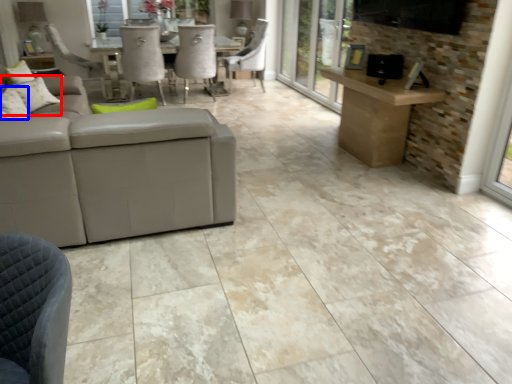
Question: Among these objects, which one is farthest to the camera, pillow (highlighted by a red box) or pillow (highlighted by a blue box)?

Choices:
 (A) pillow
 (B) pillow

Answer: (A)